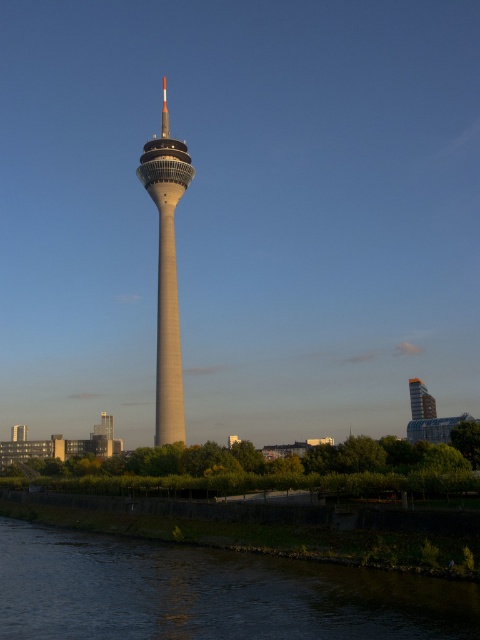
Looking at this image, you are standing at point A, which is at coordinates (210, 593). You want to walk to the tower in the distance. Which direction should you go to avoid the dark water at lower left?

To avoid the dark water at lower left, you should head towards the tower by moving away from the dark water located at your current position. Since the dark water is at the lower left relative to your position at point A, you should move in a direction that takes you away from the lower left, such as northeast or directly towards the tower which is likely in the opposite direction.

You are standing on the grassy embankment near the dark water at lower left and want to walk to the smooth concrete tower at center. Which direction should you head towards?

The dark water at lower left is positioned under the smooth concrete tower at center, so you should head towards the center to reach the smooth concrete tower at center from the dark water at lower left.